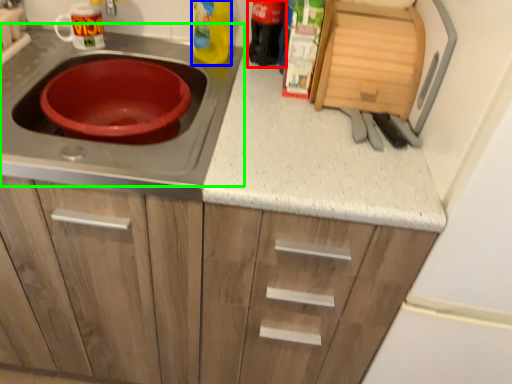
Question: Estimate the real-world distances between objects in this image. Which object is farther from bottle (highlighted by a red box), bottle (highlighted by a blue box) or gas stove (highlighted by a green box)?

Choices:
 (A) bottle
 (B) gas stove

Answer: (B)